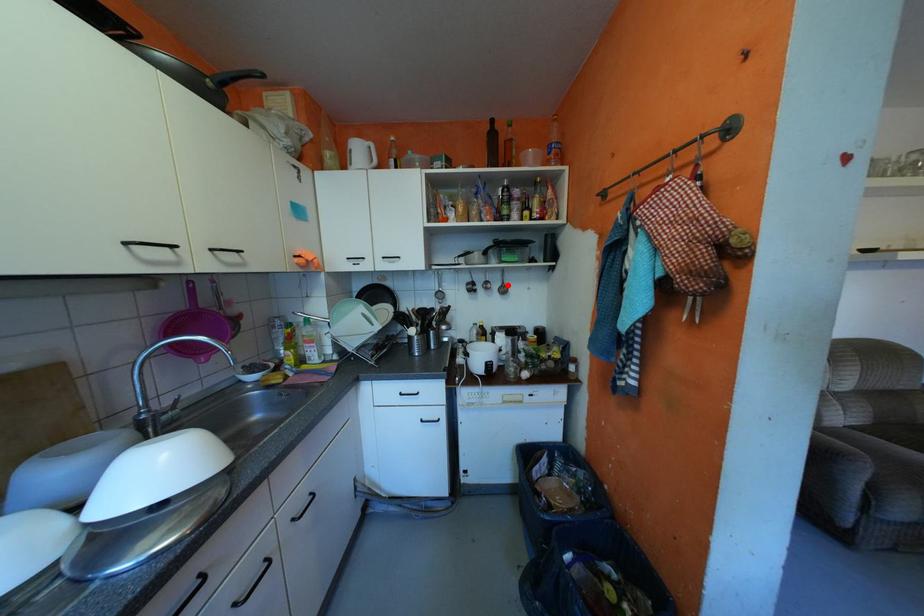
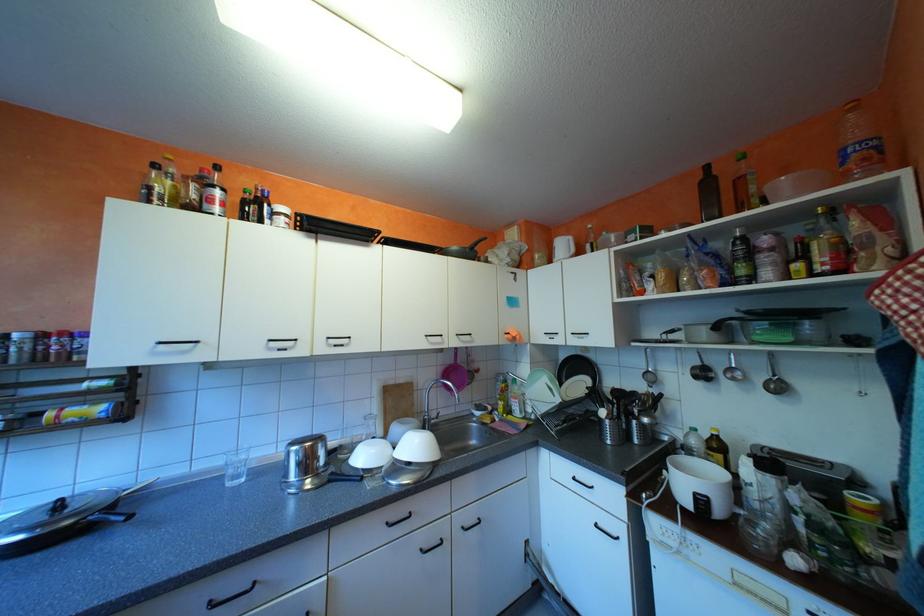
Where in the second image is the point corresponding to the highlighted location from the first image?

(772, 377)